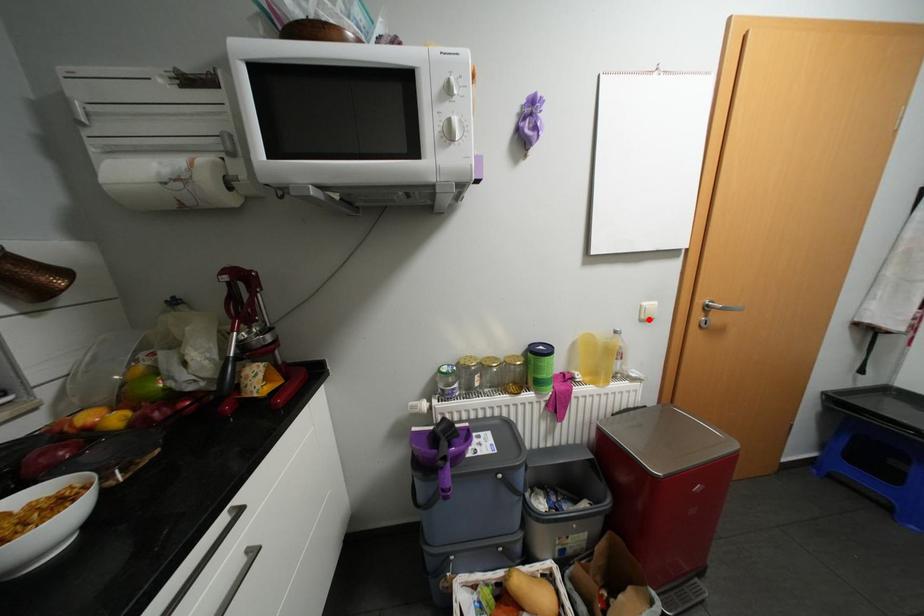
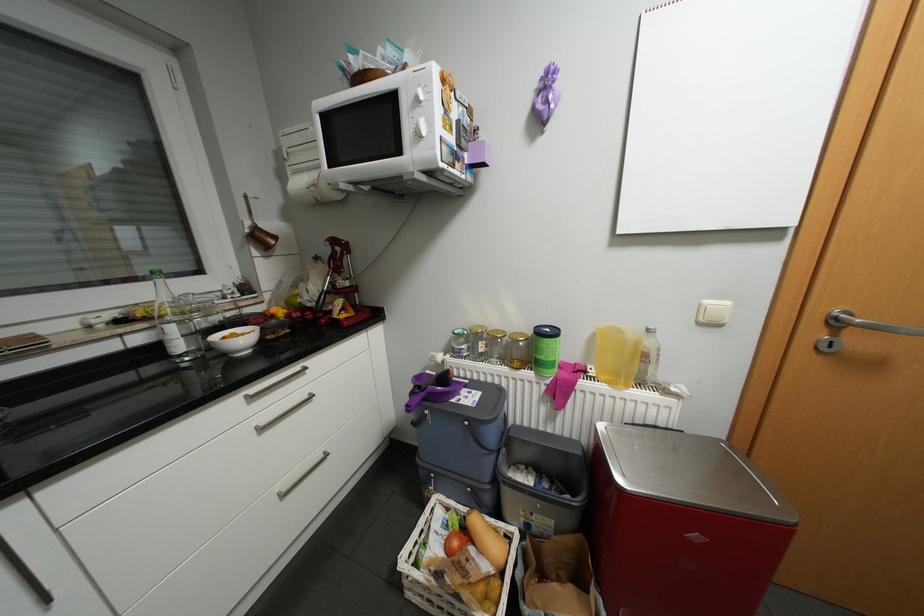
Find the pixel in the second image that matches the highlighted location in the first image.

(708, 323)